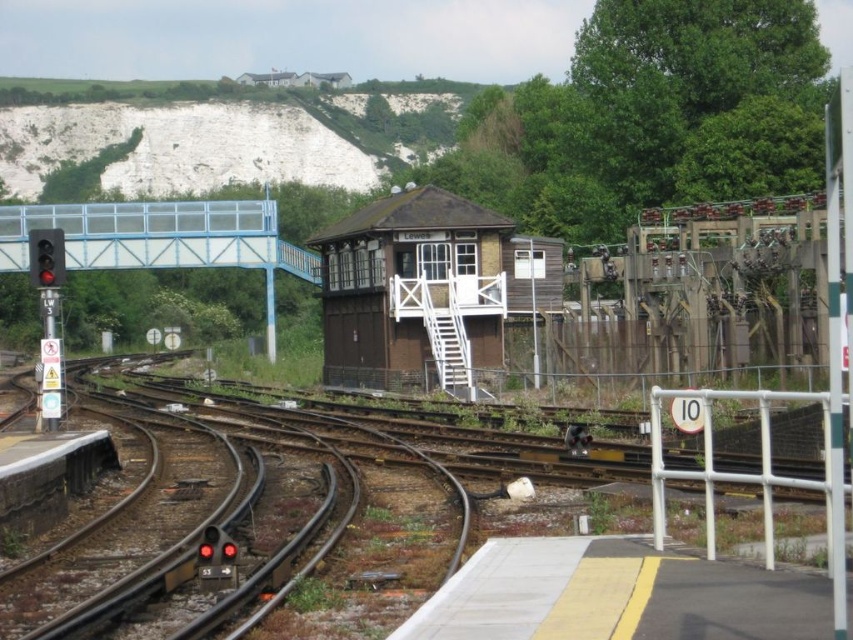
Question: From the image, what is the correct spatial relationship of brown wooden track at center in relation to brown wooden signal box at center?

Choices:
 (A) right
 (B) left

Answer: (B)

Question: Is brown wooden track at center positioned at the back of brown wooden signal box at center?

Choices:
 (A) no
 (B) yes

Answer: (A)

Question: Which point appears closest to the camera in this image?

Choices:
 (A) (456, 360)
 (B) (461, 541)

Answer: (B)

Question: Does brown wooden track at center appear over brown wooden signal box at center?

Choices:
 (A) no
 (B) yes

Answer: (A)